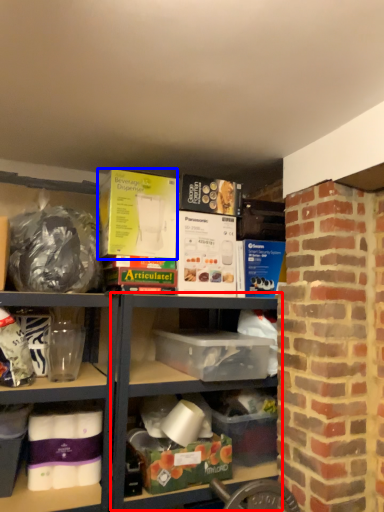
Question: Which object is closer to the camera taking this photo, shelf (highlighted by a red box) or box (highlighted by a blue box)?

Choices:
 (A) shelf
 (B) box

Answer: (A)